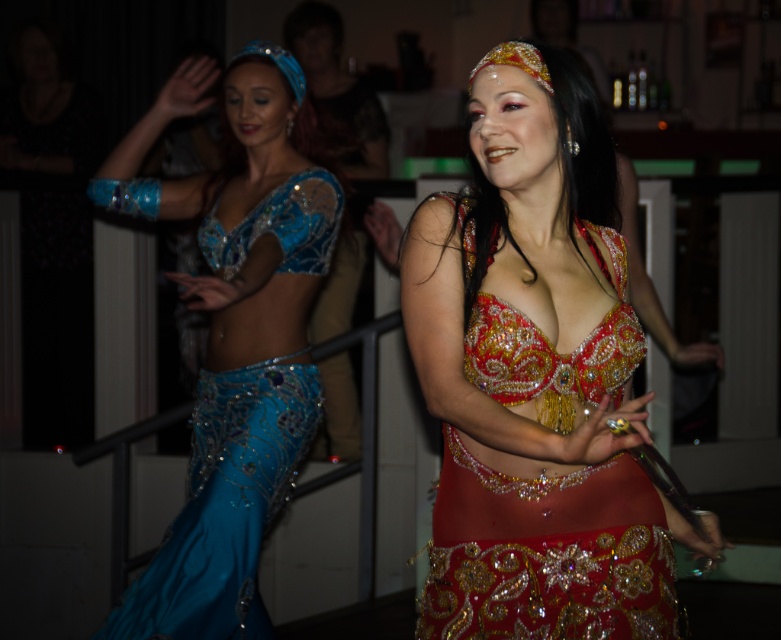
Question: Is the position of shiny sequined costume at center more distant than that of shiny blue fabric at left?

Choices:
 (A) yes
 (B) no

Answer: (B)

Question: Which point is closer to the camera taking this photo?

Choices:
 (A) (457, 196)
 (B) (166, 560)

Answer: (A)

Question: Considering the relative positions of shiny sequined costume at center and shiny blue fabric at left in the image provided, where is shiny sequined costume at center located with respect to shiny blue fabric at left?

Choices:
 (A) above
 (B) below

Answer: (B)

Question: Among these points, which one is farthest from the camera?

Choices:
 (A) (209, 264)
 (B) (604, 468)

Answer: (A)

Question: In this image, where is shiny sequined costume at center located relative to shiny blue fabric at left?

Choices:
 (A) below
 (B) above

Answer: (A)